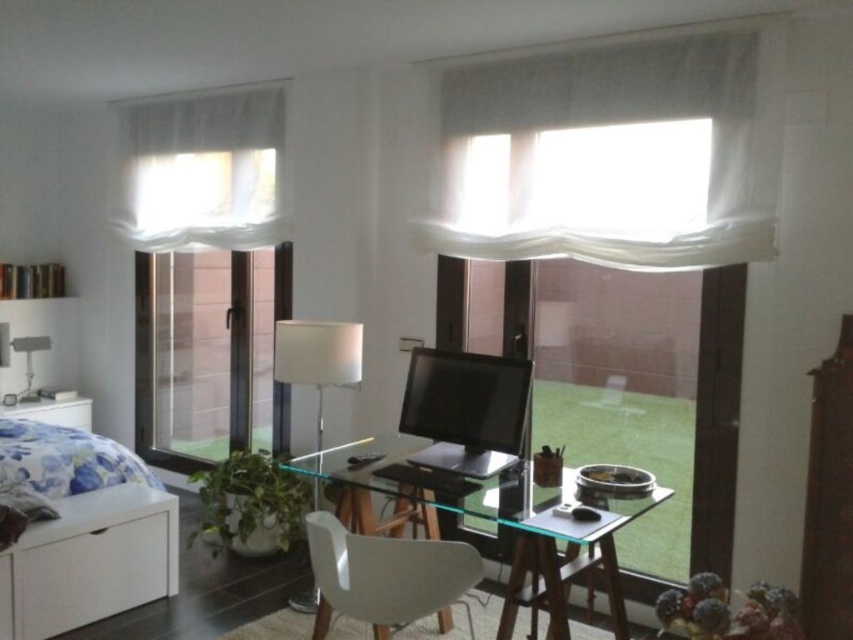
Question: Which point is farther to the camera?

Choices:
 (A) (82, 598)
 (B) (413, 588)

Answer: (A)

Question: Is white matte bed at lower left bigger than white matte chair at center?

Choices:
 (A) no
 (B) yes

Answer: (B)

Question: Which object appears farthest from the camera in this image?

Choices:
 (A) transparent glass door at center
 (B) white sheer curtain at upper left

Answer: (A)

Question: Can you confirm if white sheer curtain at upper center is bigger than white matte bed at lower left?

Choices:
 (A) no
 (B) yes

Answer: (B)

Question: Which of the following is the farthest from the observer?

Choices:
 (A) white sheer curtain at upper left
 (B) transparent glass door at center
 (C) transparent glass computer desk at center

Answer: (B)

Question: Can you confirm if white matte bed at lower left is positioned to the right of white matte chair at center?

Choices:
 (A) yes
 (B) no

Answer: (B)